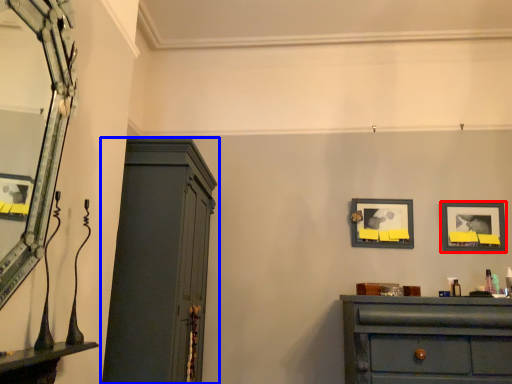
Question: Which of the following is the closest to the observer, picture frame (highlighted by a red box) or cupboard (highlighted by a blue box)?

Choices:
 (A) picture frame
 (B) cupboard

Answer: (B)